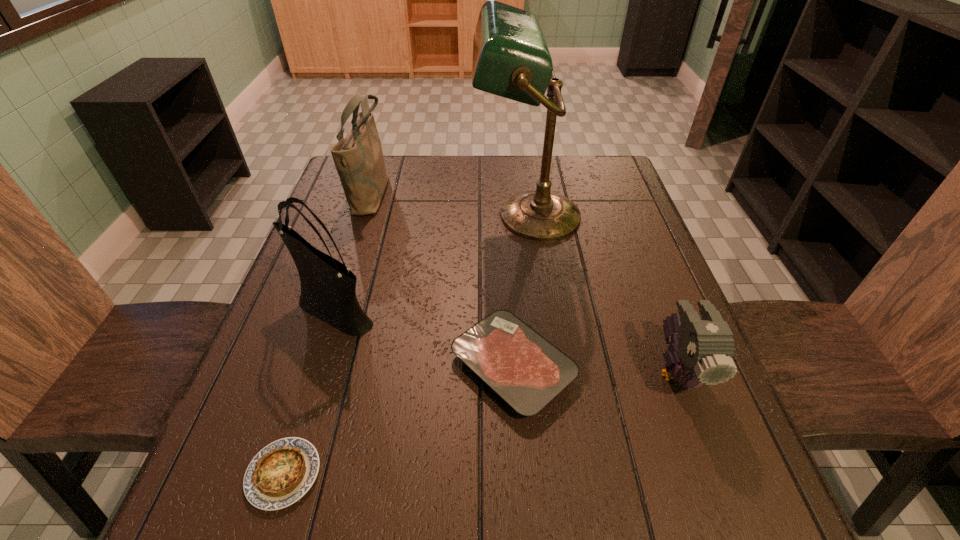
The height and width of the screenshot is (540, 960). What are the coordinates of `free point between the steak and the nearest object` in the screenshot? It's located at (398, 420).

The width and height of the screenshot is (960, 540). I want to click on empty space between the tallest object and the nearer shoulder bag, so click(430, 263).

You are a GUI agent. You are given a task and a screenshot of the screen. Output one action in this format:
    pyautogui.click(x=<x>, y=<y>)
    Task: Click on the vacant point located between the quiche and the table lamp
    The height and width of the screenshot is (540, 960).
    Given the screenshot: What is the action you would take?
    pyautogui.click(x=405, y=345)

Find the location of a particular element. Image resolution: width=960 pixels, height=540 pixels. free space between the farther shoulder bag and the fourth tallest object is located at coordinates (524, 282).

In order to click on vacant point located between the tallest object and the farther shoulder bag in this screenshot , I will do `click(449, 204)`.

In order to click on free area in between the farther shoulder bag and the shortest object in this screenshot , I will do `click(327, 333)`.

Image resolution: width=960 pixels, height=540 pixels. Identify the location of free area in between the tallest object and the farther shoulder bag. (449, 204).

Identify the location of free space between the nearer shoulder bag and the nearest object. This screenshot has width=960, height=540. (308, 392).

Select which object appears as the closest to the farther shoulder bag. Please provide its 2D coordinates. Your answer should be formatted as a tuple, i.e. [(x, y)], where the tuple contains the x and y coordinates of a point satisfying the conditions above.

[(511, 59)]

Where is `object that is the fourth closest to the farther shoulder bag`? The image size is (960, 540). object that is the fourth closest to the farther shoulder bag is located at coordinates (280, 474).